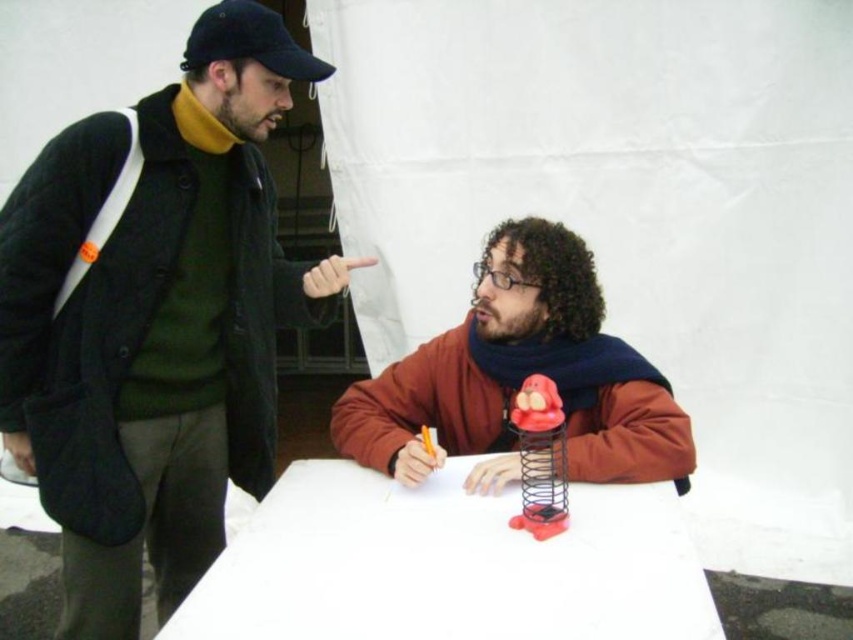
Question: Is the position of white paper at center more distant than that of matte orange jacket at center?

Choices:
 (A) no
 (B) yes

Answer: (A)

Question: Which object is farther from the camera taking this photo?

Choices:
 (A) rubberized plastic spring at center
 (B) matte black jacket at left
 (C) white paper at center
 (D) matte orange jacket at center

Answer: (D)

Question: Is white paper at center wider than matte orange jacket at center?

Choices:
 (A) yes
 (B) no

Answer: (A)

Question: Which of the following is the farthest from the observer?

Choices:
 (A) rubberized plastic spring at center
 (B) white paper at center
 (C) matte black jacket at left
 (D) matte orange jacket at center

Answer: (D)

Question: Which of these objects is positioned farthest from the white paper at center?

Choices:
 (A) rubberized plastic spring at center
 (B) matte orange jacket at center
 (C) matte black jacket at left

Answer: (C)

Question: Is matte black jacket at left further to the viewer compared to white paper at center?

Choices:
 (A) yes
 (B) no

Answer: (A)